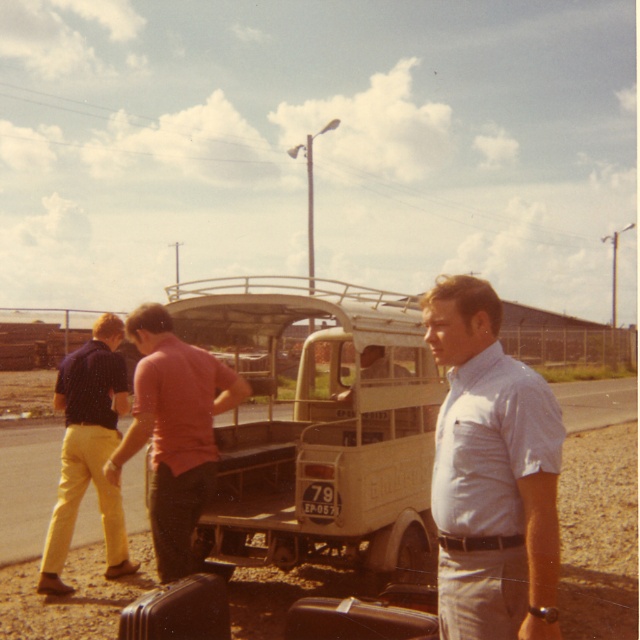
You are a delivery person trying to secure a package on the beige matte truck at center. However, there is a light brown leather jacket at center in the way. Based on their positions, can you place the package on the truck without moving the jacket?

The beige matte truck at center is positioned under the light brown leather jacket at center, meaning the jacket is above the truck. Therefore, you can place the package on the truck without moving the jacket as it is already elevated above the truck bed.

You are standing 5 feet away from the camera. Can you reach the light blue shirt at center without moving?

The light blue shirt at center is 7.36 feet from the camera. Since you are only 5 feet away from the camera, you are closer to the camera than the shirt, so you cannot reach it without moving forward.

You are standing at the origin point in the scene. The beige matte truck at center is at coordinates 0.669 on the x and 0.502 on the y axis. If you want to walk directly to the truck, which direction should you move in terms of x and y coordinates?

To reach the beige matte truck at center located at coordinates x 0.669 and y 0.502, you should move in the positive x direction and the positive y direction since both coordinates are greater than zero.